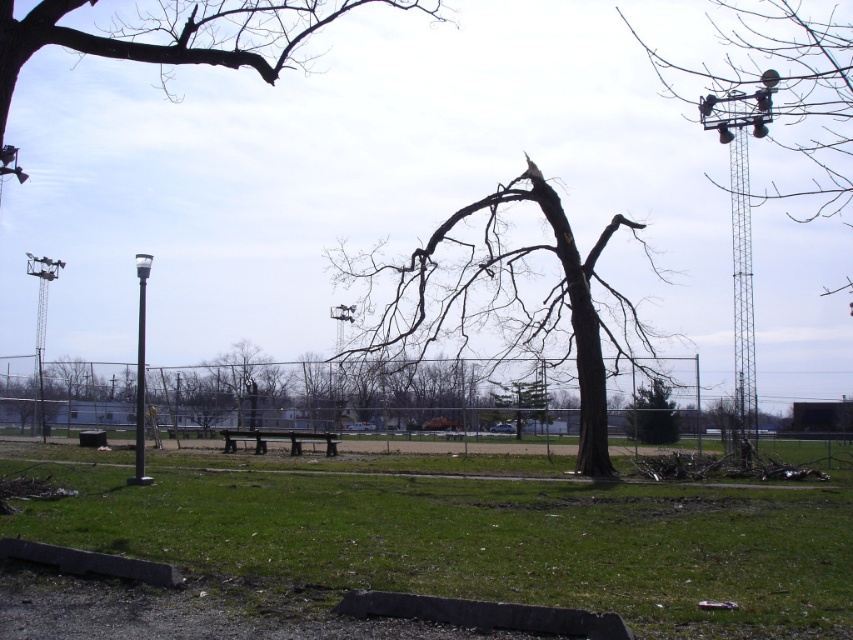
You are a photographer planning to capture a wide shot of the park scene. You want to ensure both the metallic gray tower at upper right and the green leafy tree at center are clearly visible in your frame. Considering their sizes, which object should you position closer to the center of your composition to emphasize its prominence?

The metallic gray tower at upper right is larger in size than the green leafy tree at center, so positioning it closer to the center of the composition will emphasize its prominence.

You are standing at the point with coordinates point (258,636) and want to walk towards the tree in the center. Will you pass by point (376,330) before reaching the tree?

Point (258,636) is in front of point (376,330), so you will not pass by point (376,330) before reaching the tree in the center.